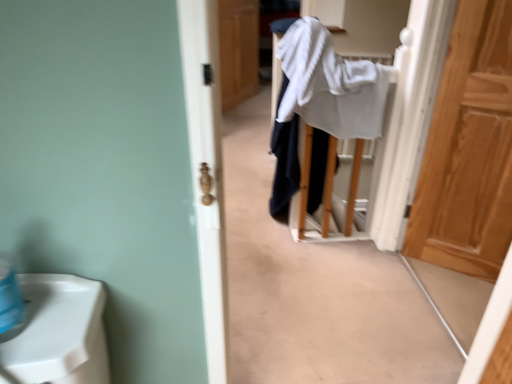
Question: Considering the positions of wooden door at center, the second door from the right, and white cotton bath towel at center in the image, is wooden door at center, the second door from the right, wider or thinner than white cotton bath towel at center?

Choices:
 (A) thin
 (B) wide

Answer: (A)

Question: Is wooden door at center, placed as the 2th door when sorted from bottom to top, bigger or smaller than white cotton bath towel at center?

Choices:
 (A) small
 (B) big

Answer: (A)

Question: Considering the real-world distances, which object is farthest from the white cotton bath towel at center?

Choices:
 (A) light brown wood door at right, the first door from the right
 (B) wooden door at center, placed as the 2th door when sorted from bottom to top

Answer: (B)

Question: Which object is the closest to the white cotton bath towel at center?

Choices:
 (A) wooden door at center, the 2th door from the front
 (B) light brown wood door at right, which appears as the second door when viewed from the top

Answer: (B)